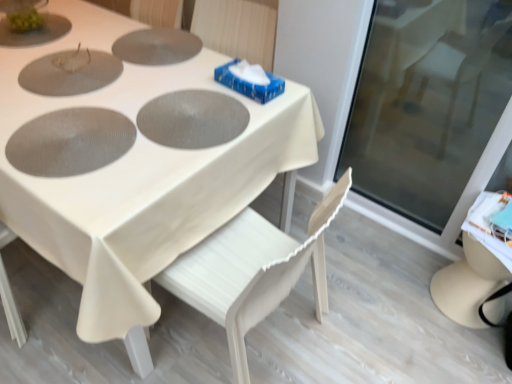
At what (x,y) coordinates should I click in order to perform the action: click on vacant space to the right of white wood chair at center. Please return your answer as a coordinate pair (x, y). Looking at the image, I should click on (364, 315).